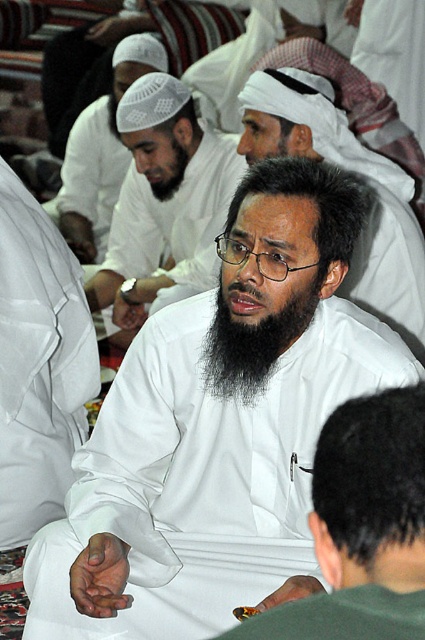
In the scene, there are two items of white matte clothing at center and white matte shirt at center. Which one is taller?

The white matte clothing at center is taller than the white matte shirt at center.

You are an event planner trying to arrange seating for a photo. You need to place the white matte headscarf at upper center and the black matte beard at center so that they are visible in the frame. Considering their sizes, which object should be placed closer to the camera to ensure both fit well in the photo?

The white matte headscarf at upper center has a larger width than the black matte beard at center. To ensure both fit well in the photo, the headscarf should be placed closer to the camera since larger objects need to be nearer to maintain proportion and visibility without overcrowding the frame.